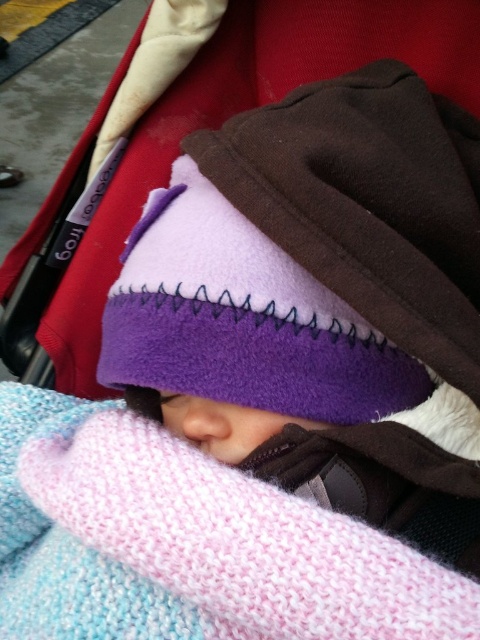
You are a parent trying to ensure your child stays warm. You notice the purple fleece hat at center and the pink knitted blanket at center. Which item is covering the other?

The purple fleece hat at center is positioned over the pink knitted blanket at center, so it is covering the blanket.

You are a parent trying to ensure your child stays warm while outdoors. You notice the purple fleece hat at center and the pink knitted blanket at center. Can you determine if there is enough space between them to comfortably adjust the blanket without disturbing the hat?

The purple fleece hat at center and pink knitted blanket at center are 20.04 centimeters apart from each other. This distance should provide sufficient space to adjust the blanket without disturbing the hat.